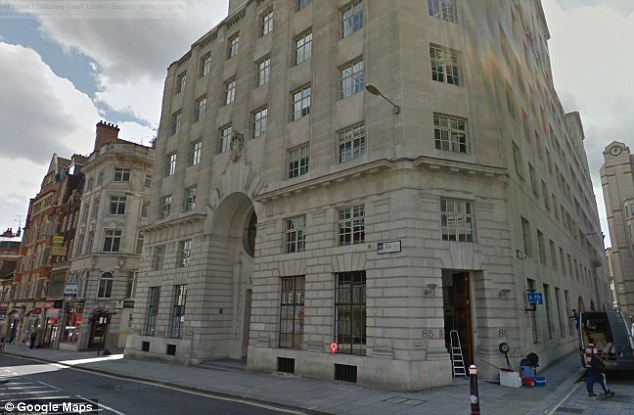
The height and width of the screenshot is (415, 634). Identify the location of step ladder. (458, 355).